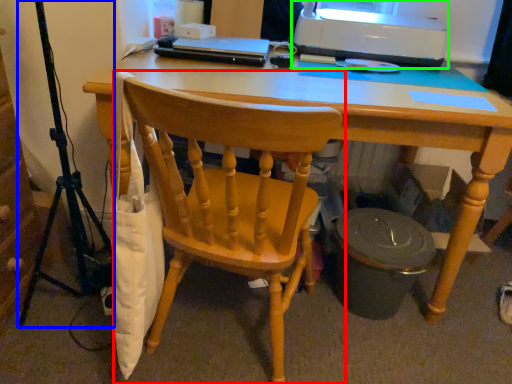
Question: Based on their relative distances, which object is nearer to chair (highlighted by a red box)? Choose from tripod (highlighted by a blue box) and printer (highlighted by a green box).

Choices:
 (A) tripod
 (B) printer

Answer: (A)